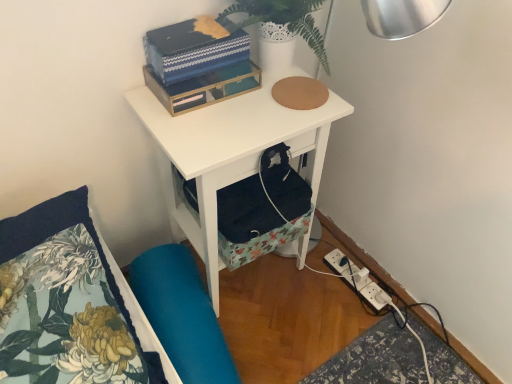
Locate an element on the screen. This screenshot has height=384, width=512. free point above floral fabric pillow at lower left (from a real-world perspective) is located at coordinates (54, 294).